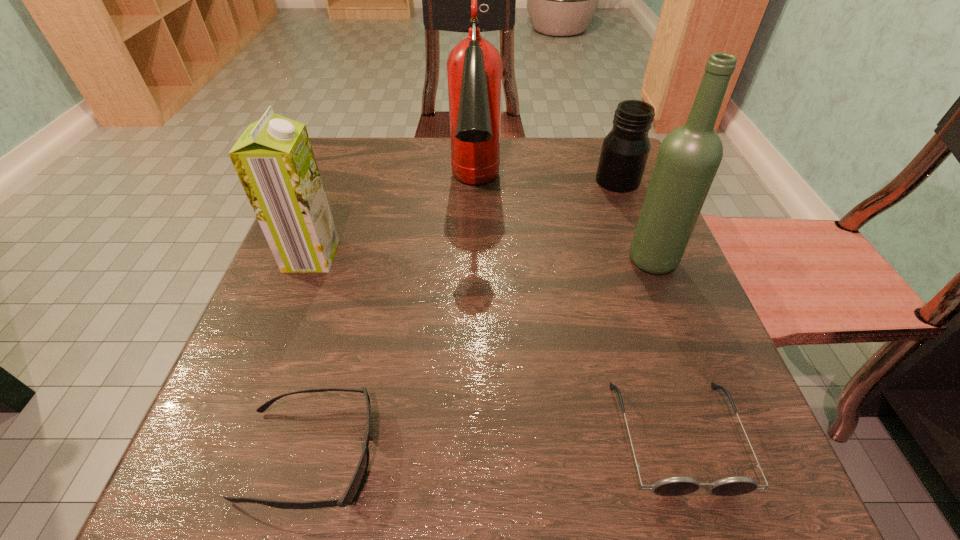
Where is `free space in the image that satisfies the following two spatial constraints: 1. at the nozzle end of the wine bottle; 2. on the left side of the fire extinguisher`? The width and height of the screenshot is (960, 540). free space in the image that satisfies the following two spatial constraints: 1. at the nozzle end of the wine bottle; 2. on the left side of the fire extinguisher is located at coordinates (474, 259).